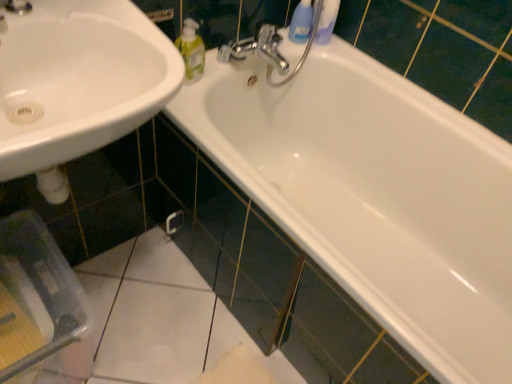
Where is `vacant space underneath white glossy sink at lower left (from a real-world perspective)`? This screenshot has width=512, height=384. vacant space underneath white glossy sink at lower left (from a real-world perspective) is located at coordinates (121, 284).